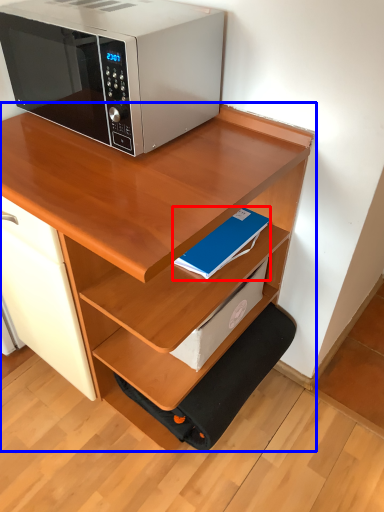
Question: Which object appears closest to the camera in this image, paperback book (highlighted by a red box) or desk (highlighted by a blue box)?

Choices:
 (A) paperback book
 (B) desk

Answer: (B)